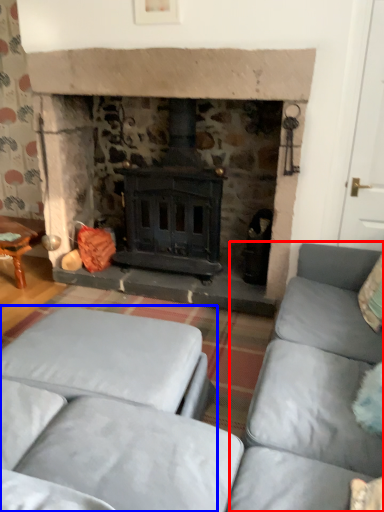
Question: Among these objects, which one is nearest to the camera, couch (highlighted by a red box) or studio couch (highlighted by a blue box)?

Choices:
 (A) couch
 (B) studio couch

Answer: (A)